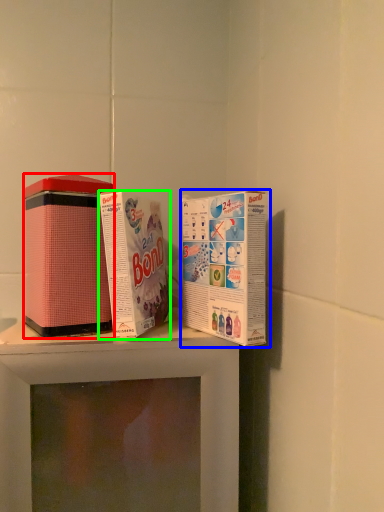
Question: Which object is the farthest from product (highlighted by a red box)? Choose among these: product (highlighted by a blue box) or product (highlighted by a green box).

Choices:
 (A) product
 (B) product

Answer: (A)